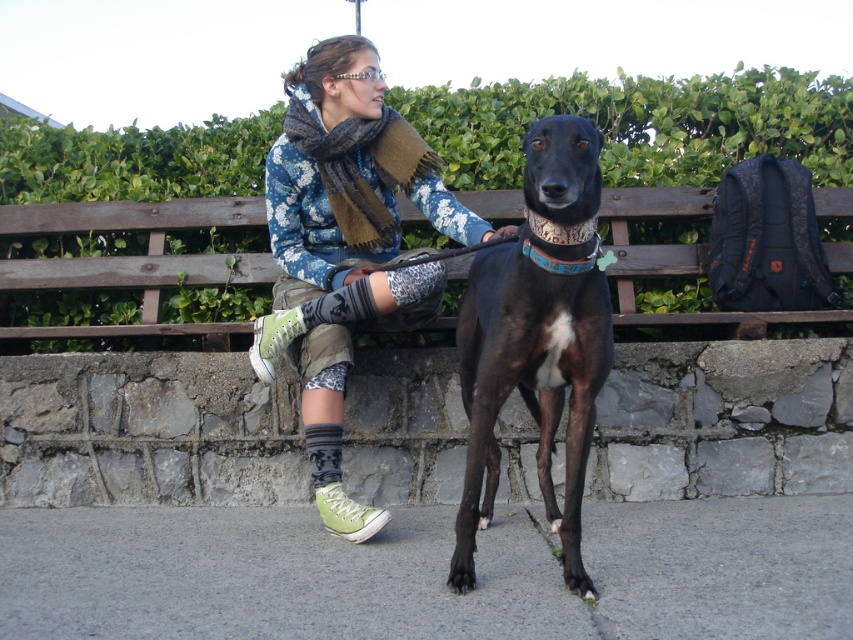
Question: Does green leafy hedge at upper center have a lesser width compared to black smooth dog at center?

Choices:
 (A) yes
 (B) no

Answer: (B)

Question: Is green leafy hedge at upper center smaller than floral-patterned sweater at center?

Choices:
 (A) no
 (B) yes

Answer: (A)

Question: Which object is positioned closest to the floral-patterned sweater at center?

Choices:
 (A) black smooth dog at center
 (B) green leafy hedge at upper center

Answer: (A)

Question: Does gray asphalt pavement at lower center appear on the left side of black smooth dog at center?

Choices:
 (A) no
 (B) yes

Answer: (B)

Question: Which point is farther to the camera?

Choices:
 (A) floral-patterned sweater at center
 (B) green leafy hedge at upper center
 (C) black smooth dog at center
 (D) brown woolen scarf at upper center

Answer: (B)

Question: Which object appears farthest from the camera in this image?

Choices:
 (A) black smooth dog at center
 (B) brown woolen scarf at upper center
 (C) gray asphalt pavement at lower center

Answer: (B)